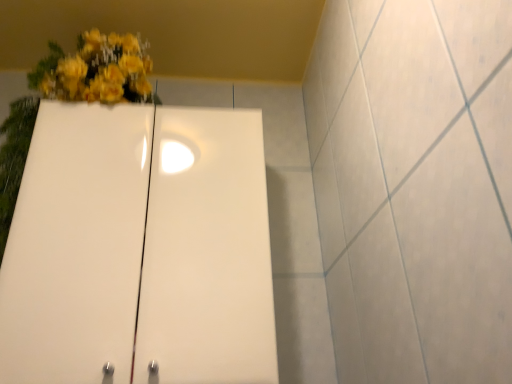
Question: Should I look upward or downward to see white glossy cabinet at upper left?

Choices:
 (A) down
 (B) up

Answer: (A)